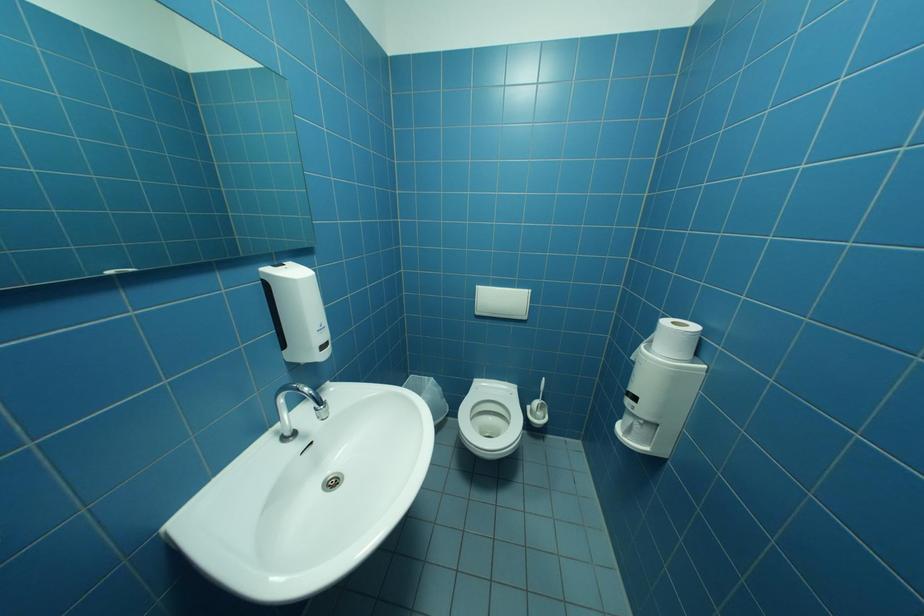
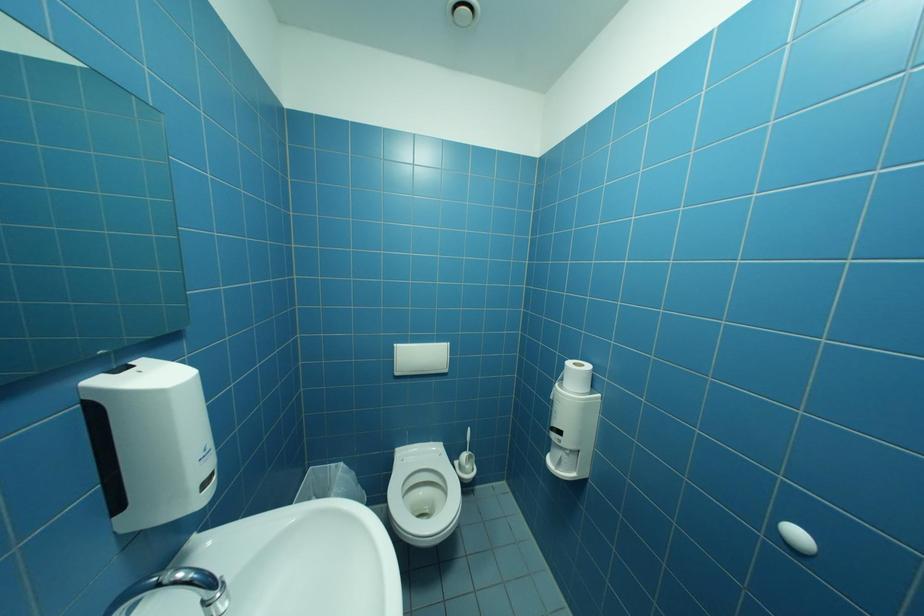
Question: How did the camera likely rotate?

Choices:
 (A) Left
 (B) Right
 (C) Up
 (D) Down

Answer: (B)